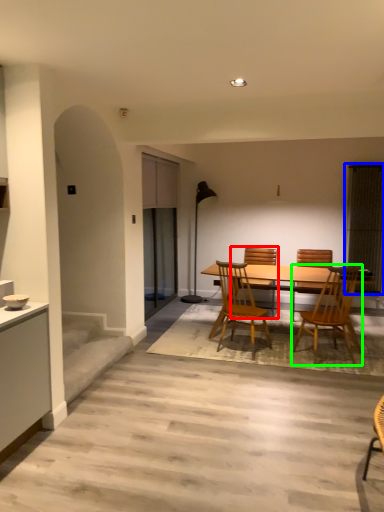
Question: Based on their relative distances, which object is nearer to chair (highlighted by a red box)? Choose from window screen (highlighted by a blue box) and chair (highlighted by a green box).

Choices:
 (A) window screen
 (B) chair

Answer: (A)